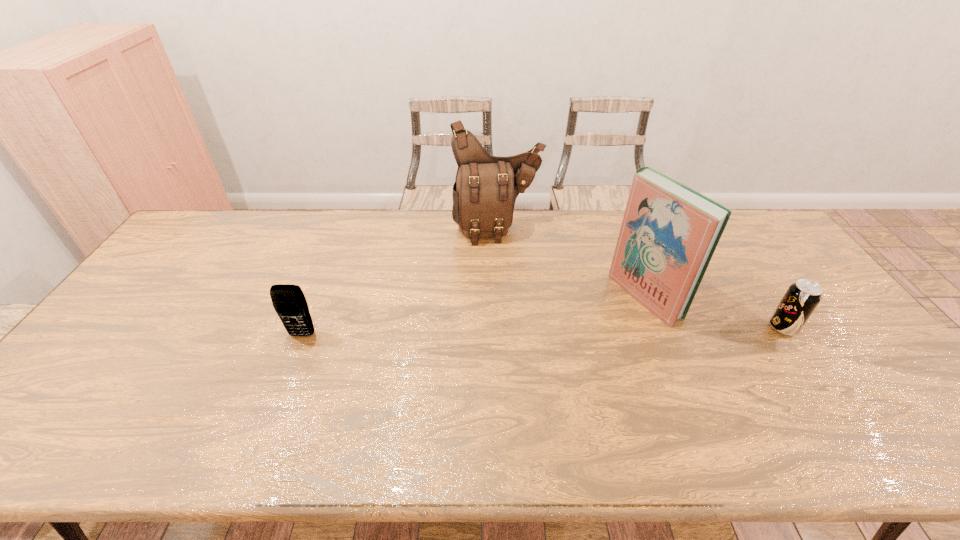
The image size is (960, 540). What are the coordinates of `vacant region located 0.060m on the front-facing side of the shoulder bag` in the screenshot? It's located at (509, 258).

Find the location of a particular element. The image size is (960, 540). vacant point located on the cover of the second object from right to left is located at coordinates (538, 358).

Locate an element on the screen. The height and width of the screenshot is (540, 960). vacant space located on the cover of the second object from right to left is located at coordinates (585, 333).

Identify the location of vacant region located 0.380m on the cover of the second object from right to left. (516, 370).

You are a GUI agent. You are given a task and a screenshot of the screen. Output one action in this format:
    pyautogui.click(x=<x>, y=<y>)
    Task: Click on the object present at the far edge
    The image size is (960, 540).
    Given the screenshot: What is the action you would take?
    pyautogui.click(x=486, y=187)

The width and height of the screenshot is (960, 540). Find the location of `object that is at the right edge`. object that is at the right edge is located at coordinates (802, 297).

The width and height of the screenshot is (960, 540). I want to click on vacant space at the far edge of the desktop, so click(x=372, y=222).

Image resolution: width=960 pixels, height=540 pixels. Identify the location of vacant area at the near edge of the desktop. (681, 392).

Where is `free point at the far left corner`? free point at the far left corner is located at coordinates (236, 221).

This screenshot has width=960, height=540. Identify the location of vacant point located between the hardback book and the shortest object. point(714,312).